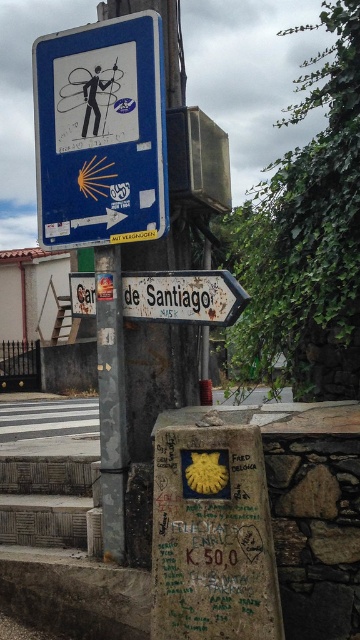
Question: Can you confirm if yellowmaterial/textureparking sign at center is wider than white wooden signpost at center?

Choices:
 (A) yes
 (B) no

Answer: (B)

Question: Which of the following is the closest to the observer?

Choices:
 (A) (206, 285)
 (B) (123, 352)
 (C) (163, 104)

Answer: (A)

Question: Is blue plastic sign at upper center further to the viewer compared to metallic pole at center?

Choices:
 (A) yes
 (B) no

Answer: (B)

Question: Which point is farther to the camera?

Choices:
 (A) blue plastic sign at upper center
 (B) metallic pole at center
 (C) white wooden signpost at center

Answer: (B)

Question: Which point is closer to the camera?

Choices:
 (A) white wooden signpost at center
 (B) yellowmaterial/textureparking sign at center

Answer: (B)

Question: Is yellowmaterial/textureparking sign at center bigger than white wooden signpost at center?

Choices:
 (A) yes
 (B) no

Answer: (B)